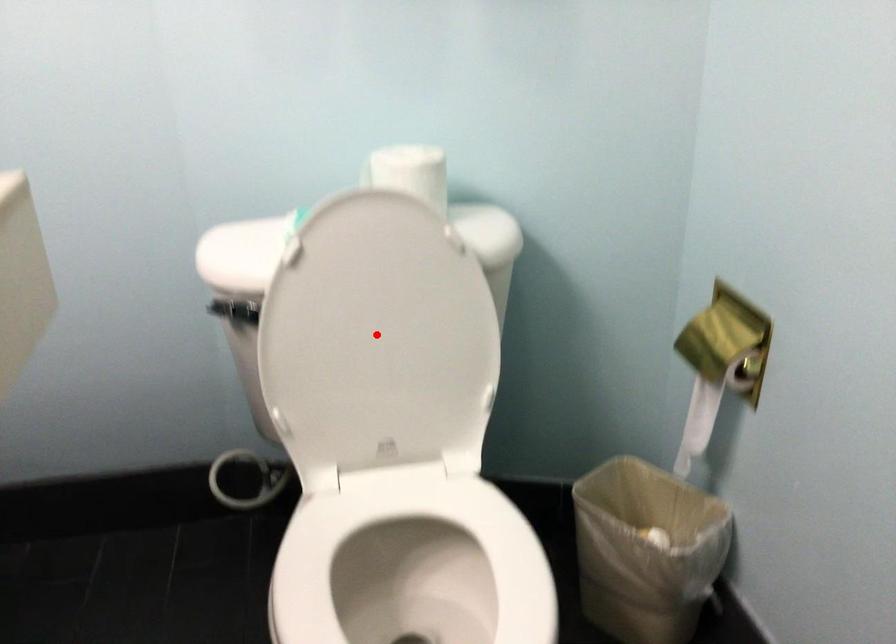
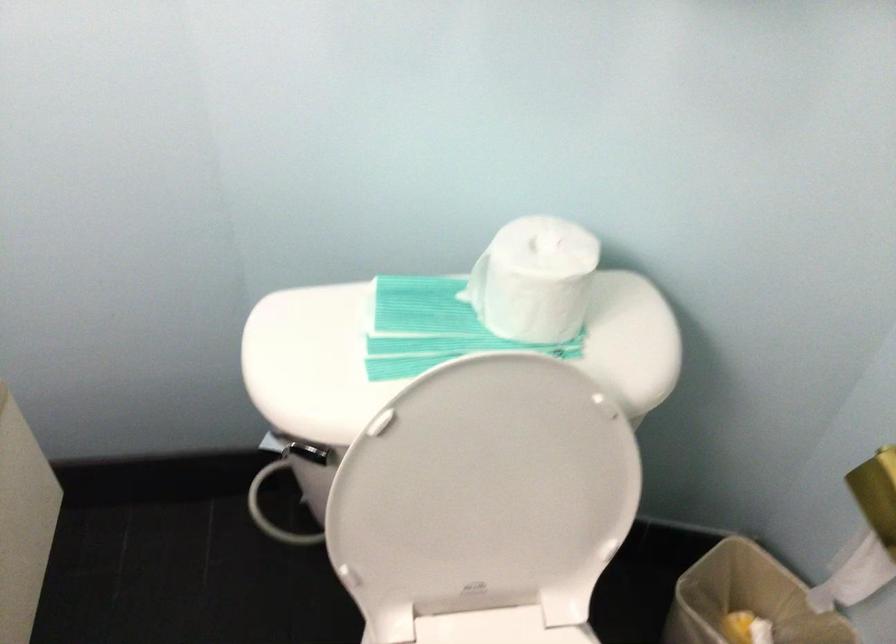
Question: I am providing you with two images of the same scene from different viewpoints. Given a red point in image1, look at the same physical point in image2. Is it:

Choices:
 (A) Closer to the viewpoint
 (B) Farther from the viewpoint

Answer: (A)